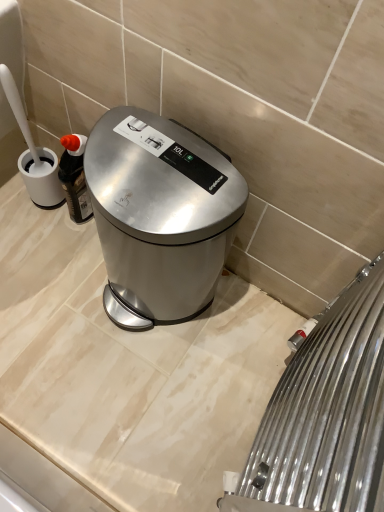
Question: Can you confirm if satin silver trash can at center is positioned to the left of satin nickel radiator at lower right?

Choices:
 (A) no
 (B) yes

Answer: (B)

Question: From the image's perspective, is satin silver trash can at center under satin nickel radiator at lower right?

Choices:
 (A) no
 (B) yes

Answer: (A)

Question: Considering the relative sizes of satin silver trash can at center and satin nickel radiator at lower right in the image provided, is satin silver trash can at center wider than satin nickel radiator at lower right?

Choices:
 (A) no
 (B) yes

Answer: (B)

Question: Is satin silver trash can at center not close to satin nickel radiator at lower right?

Choices:
 (A) yes
 (B) no

Answer: (B)

Question: Is satin nickel radiator at lower right at the back of satin silver trash can at center?

Choices:
 (A) yes
 (B) no

Answer: (B)

Question: Does satin silver trash can at center have a greater height compared to satin nickel radiator at lower right?

Choices:
 (A) yes
 (B) no

Answer: (B)

Question: From a real-world perspective, is satin nickel radiator at lower right on satin silver trash can at center?

Choices:
 (A) yes
 (B) no

Answer: (A)

Question: Is satin silver trash can at center completely or partially inside satin nickel radiator at lower right?

Choices:
 (A) yes
 (B) no

Answer: (B)

Question: Is satin nickel radiator at lower right taller than satin silver trash can at center?

Choices:
 (A) yes
 (B) no

Answer: (A)

Question: Does satin nickel radiator at lower right appear on the left side of satin silver trash can at center?

Choices:
 (A) no
 (B) yes

Answer: (A)

Question: From the image's perspective, is satin nickel radiator at lower right located above satin silver trash can at center?

Choices:
 (A) yes
 (B) no

Answer: (B)

Question: Are satin nickel radiator at lower right and satin silver trash can at center making contact?

Choices:
 (A) yes
 (B) no

Answer: (B)

Question: Would you say satin nickel radiator at lower right is to the left or to the right of satin silver trash can at center in the picture?

Choices:
 (A) left
 (B) right

Answer: (B)